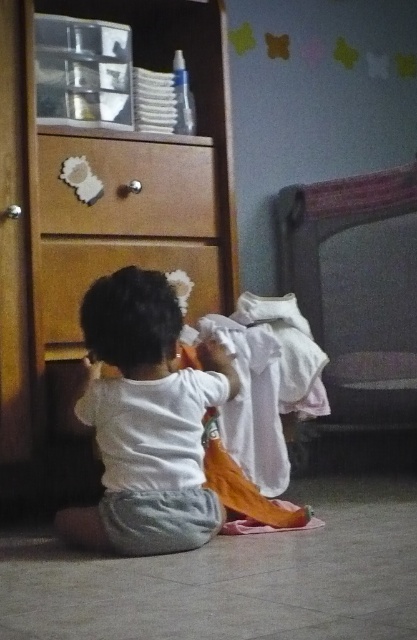
Question: Is dark gray fabric bunk bed at right to the left of wooden drawer at lower center from the viewer's perspective?

Choices:
 (A) yes
 (B) no

Answer: (B)

Question: Is wooden dresser at left closer to camera compared to white cotton shirt at lower center?

Choices:
 (A) no
 (B) yes

Answer: (A)

Question: Which point is closer to the camera?

Choices:
 (A) (138, 525)
 (B) (108, 182)
 (C) (55, 253)

Answer: (A)

Question: Does white cotton shirt at lower center appear on the right side of wooden drawer at lower center?

Choices:
 (A) yes
 (B) no

Answer: (A)

Question: Which point is farther from the camera taking this photo?

Choices:
 (A) (155, 381)
 (B) (2, 292)

Answer: (B)

Question: Which point appears closest to the camera in this image?

Choices:
 (A) (65, 259)
 (B) (52, 156)

Answer: (B)